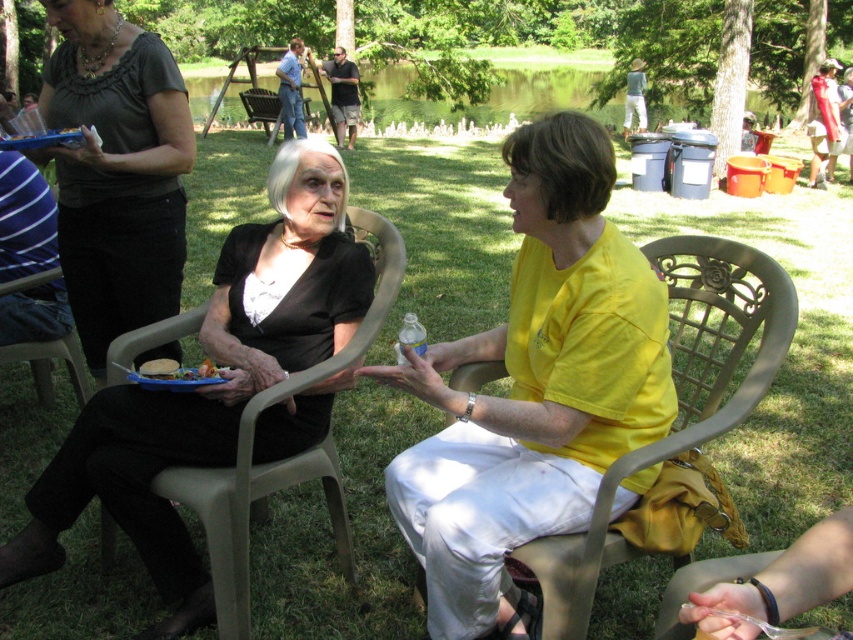
You are standing at the point marked by the coordinates point (534, 387). Looking around, you see two women seated on plastic chairs. Which woman is wearing the yellow matte shirt at center?

The yellow matte shirt at center is worn by the woman on the right, as the point (534, 387) corresponds to the yellow matte shirt at center.

You are a photographer at the park and want to capture a photo of the yellow matte shirt at center and the plastic chair at center. Based on their positions, which object should you focus on first if you want to include both in the frame without moving the camera?

The yellow matte shirt at center is positioned on the right side of plastic chair at center, so you should focus on the plastic chair at center first to ensure both objects are in the frame.